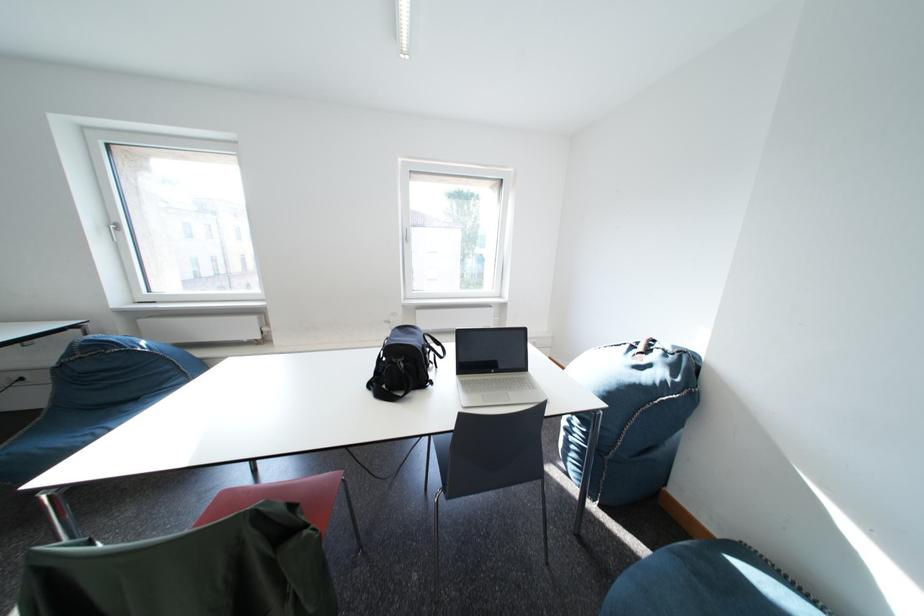
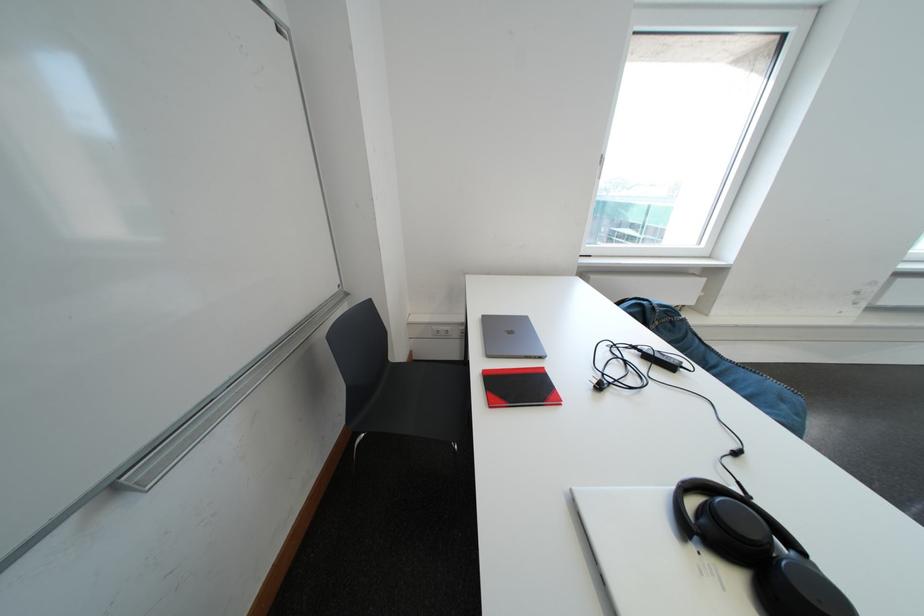
Question: What movement of the cameraman would produce the second image?

Choices:
 (A) Left
 (B) Right
 (C) Forward
 (D) Backward

Answer: (A)